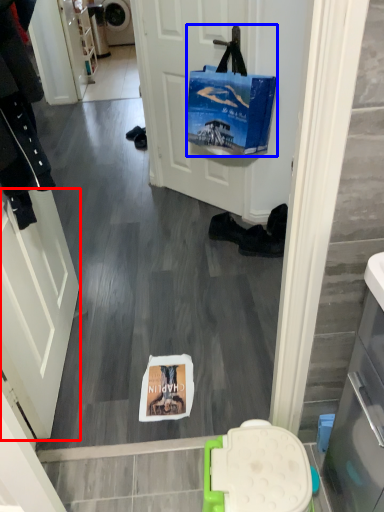
Question: Which point is further to the camera, screen door (highlighted by a red box) or handbag (highlighted by a blue box)?

Choices:
 (A) screen door
 (B) handbag

Answer: (B)